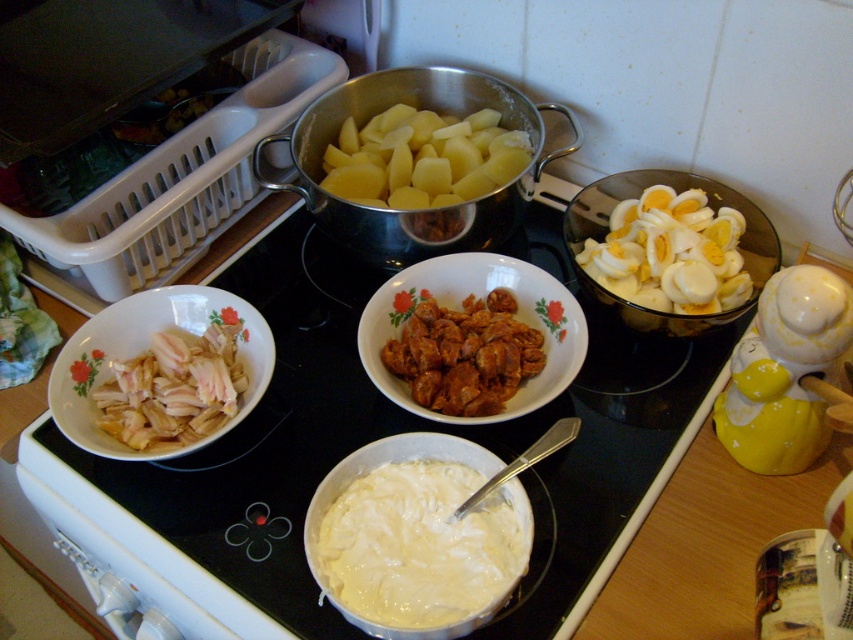
From the picture: You are preparing a meal and need to determine if the white creamy sauce at center can be heated directly on the black glass cooktop at center. Based on their sizes, will the sauce fit on the cooktop?

The black glass cooktop at center is larger in size than the white creamy sauce at center, so the sauce should fit comfortably on the cooktop for heating.

You are a chef preparing a dish and need to transfer the brown crispy chicken at center into the polished stainless steel pot at center. Given that your spatula is 6 inches long, can you safely reach from the chicken to the pot without spilling anything?

The distance between the polished stainless steel pot at center and brown crispy chicken at center is 6.90 inches. Since the spatula is only 6 inches long, it is 0.90 inches shorter than needed. Therefore, you cannot safely reach the pot from the chicken without risking spillage.